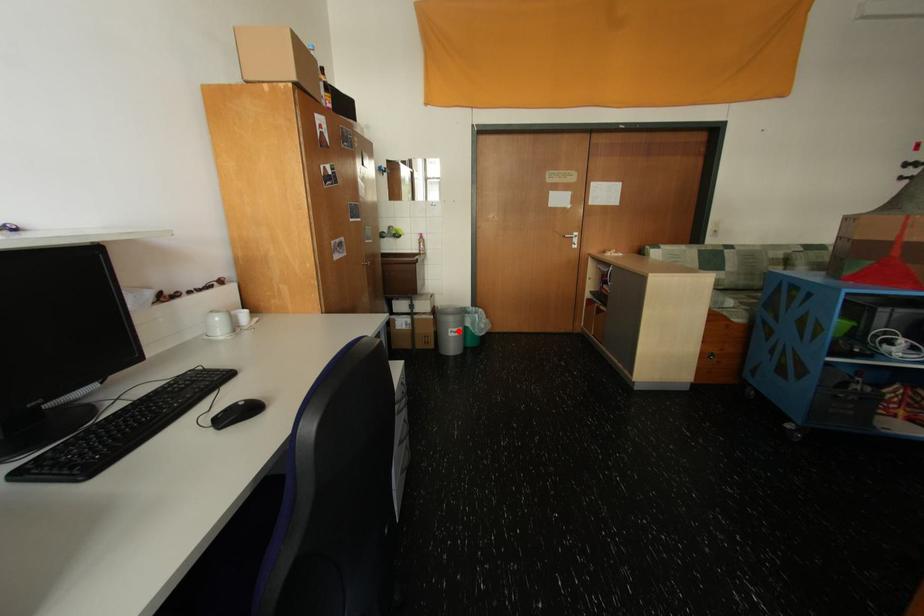
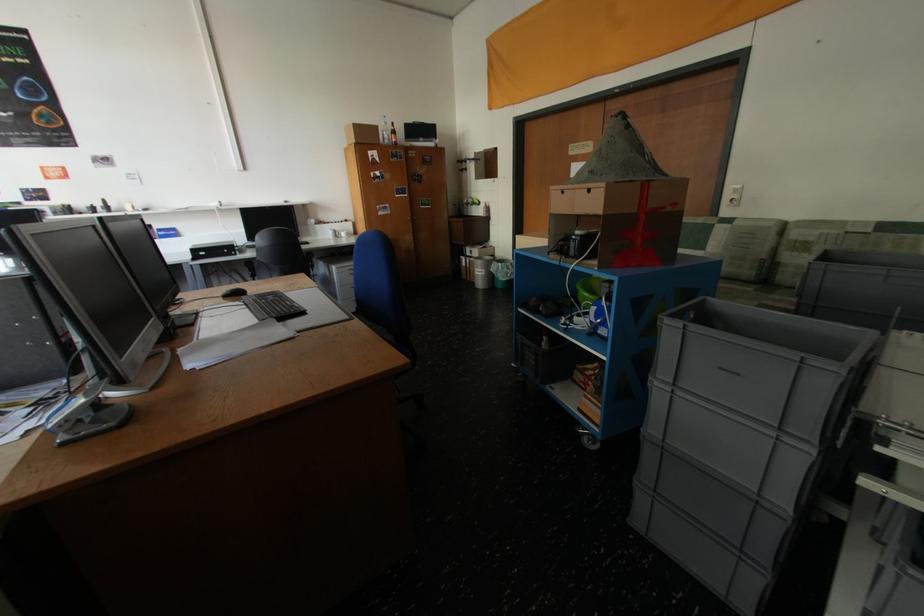
Question: I am providing you with two images of the same scene from different viewpoints. A red point is marked on the first image. At the location where the point appears in image 1, is it still visible in image 2?

Choices:
 (A) Yes
 (B) No

Answer: (A)